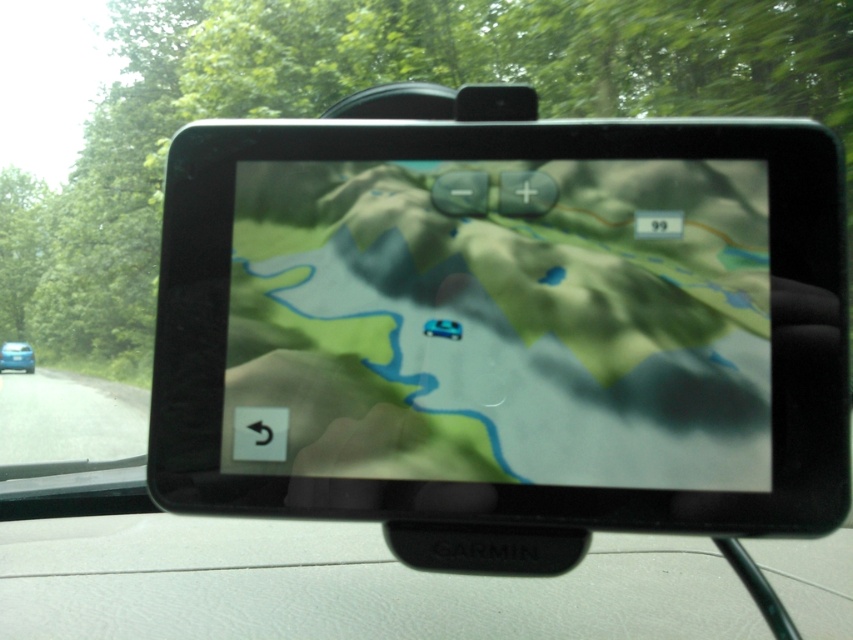
Locate an element on the screen. This screenshot has width=853, height=640. green matte map at center is located at coordinates (502, 323).

Is point (397, 243) more distant than point (4, 362)?

No, (397, 243) is closer to viewer.

Does point (543, 358) lie behind point (4, 342)?

No, (543, 358) is in front of (4, 342).

Find the location of `green matte map at center`. green matte map at center is located at coordinates (502, 323).